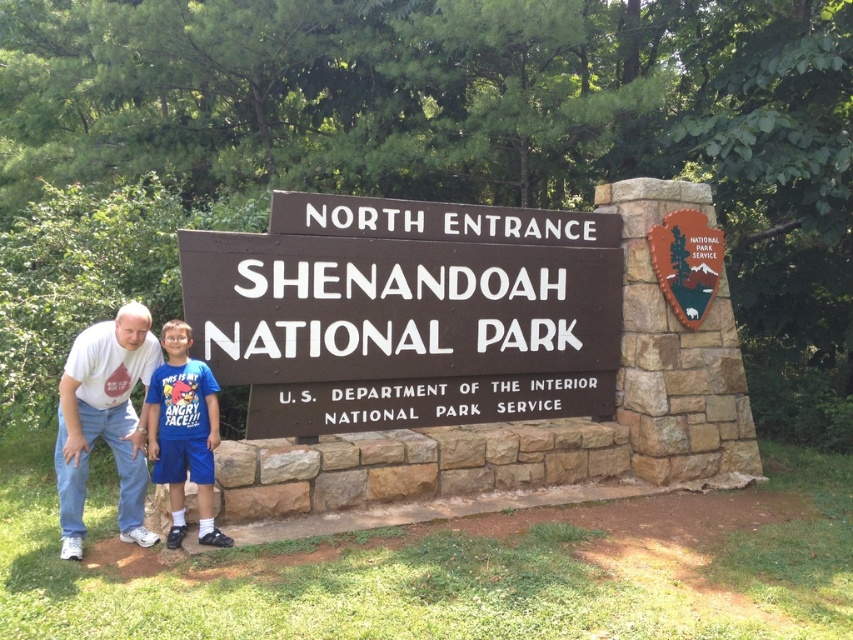
Question: Which of the following is the closest to the observer?

Choices:
 (A) blue cotton shirt at center
 (B) white t-shirt at lower left

Answer: (B)

Question: Can you confirm if white t-shirt at lower left is bigger than blue cotton shirt at center?

Choices:
 (A) yes
 (B) no

Answer: (A)

Question: Based on their relative distances, which object is nearer to the brown wooden sign at center?

Choices:
 (A) blue cotton shirt at center
 (B) white t-shirt at lower left

Answer: (A)

Question: Does brown wooden sign at center have a smaller size compared to blue cotton shirt at center?

Choices:
 (A) yes
 (B) no

Answer: (B)

Question: From the image, what is the correct spatial relationship of brown wooden sign at center in relation to white t-shirt at lower left?

Choices:
 (A) below
 (B) above

Answer: (B)

Question: Among these objects, which one is farthest from the camera?

Choices:
 (A) white t-shirt at lower left
 (B) blue cotton shirt at center

Answer: (B)